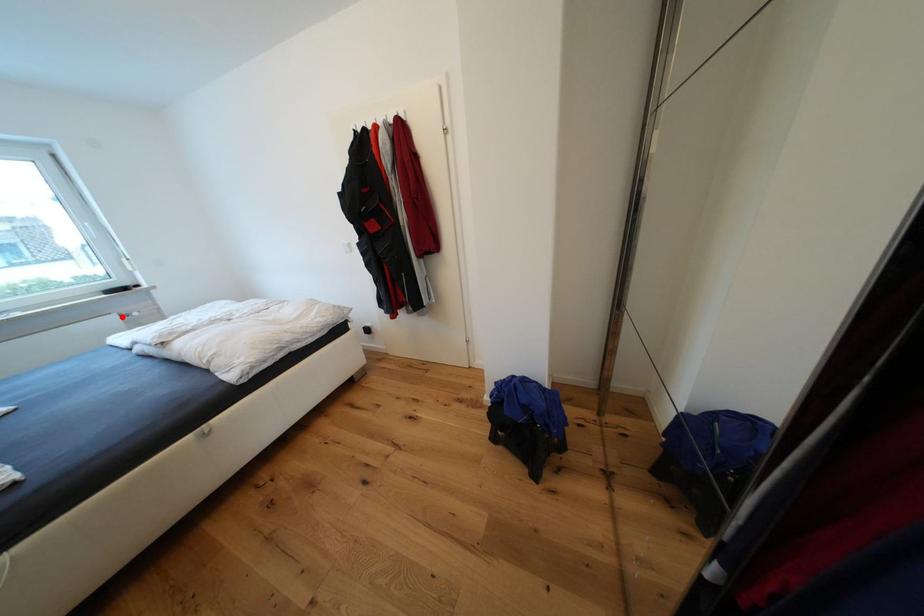
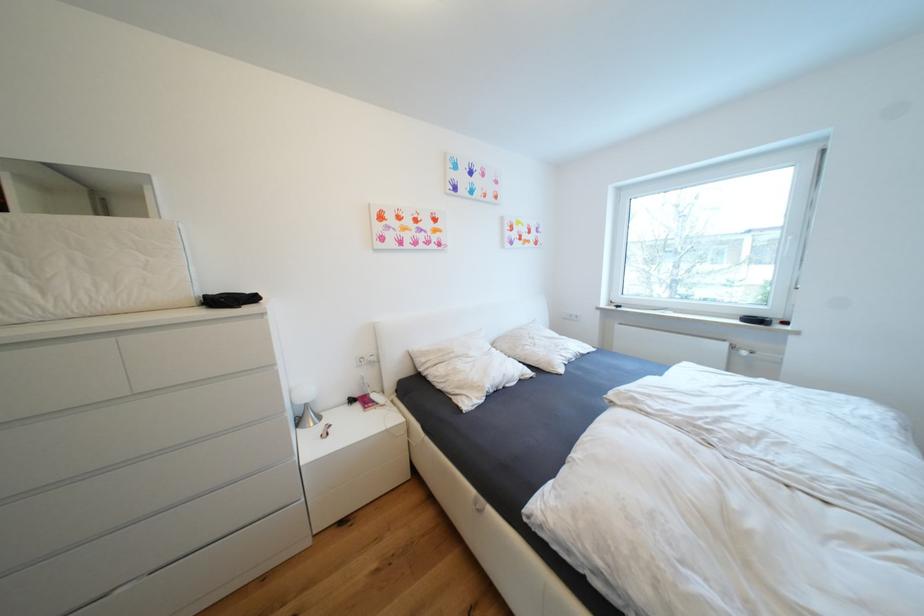
Find the pixel in the second image that matches the highlighted location in the first image.

(733, 346)